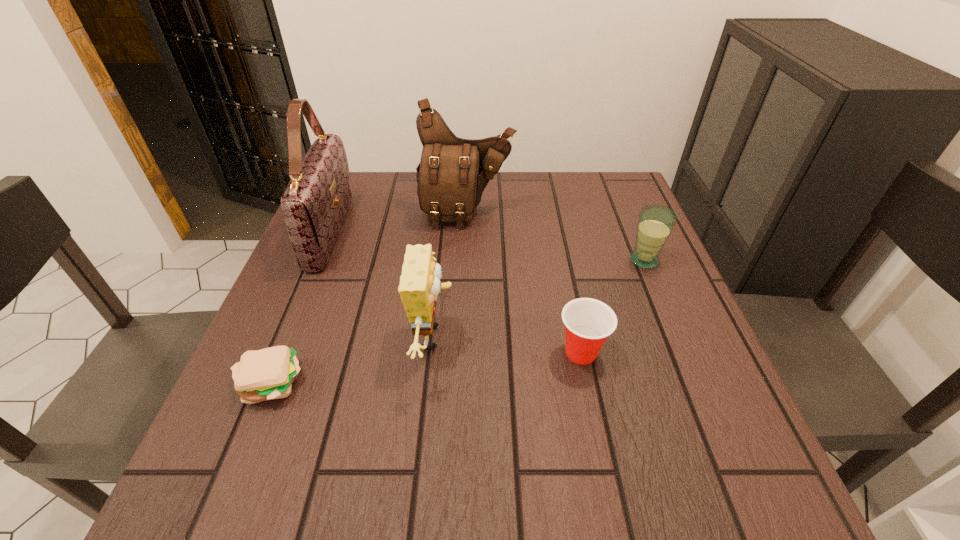
Identify the location of handbag. (315, 202).

Identify the location of shoulder bag. The image size is (960, 540). (453, 172).

You are a GUI agent. You are given a task and a screenshot of the screen. Output one action in this format:
    pyautogui.click(x=<x>, y=<y>)
    Task: Click on the third tallest object
    The image size is (960, 540).
    Given the screenshot: What is the action you would take?
    pyautogui.click(x=420, y=284)

Identify the location of the third shortest object. (655, 223).

At what (x,y) coordinates should I click in order to perform the action: click on glass. Please return your answer as a coordinate pair (x, y). This screenshot has height=540, width=960. Looking at the image, I should click on (655, 223).

This screenshot has width=960, height=540. I want to click on the second shortest object, so click(588, 322).

You are a GUI agent. You are given a task and a screenshot of the screen. Output one action in this format:
    pyautogui.click(x=<x>, y=<y>)
    Task: Click on the fifth object from left to right
    This screenshot has width=960, height=540.
    Given the screenshot: What is the action you would take?
    pyautogui.click(x=588, y=322)

Where is `patty`? The height and width of the screenshot is (540, 960). patty is located at coordinates click(x=266, y=374).

Where is `vacant space located 0.100m on the front of the tallest object with the clasp`? The width and height of the screenshot is (960, 540). vacant space located 0.100m on the front of the tallest object with the clasp is located at coordinates (387, 232).

Locate an element on the screen. This screenshot has width=960, height=540. free space located on the front-facing side of the shoulder bag is located at coordinates (462, 329).